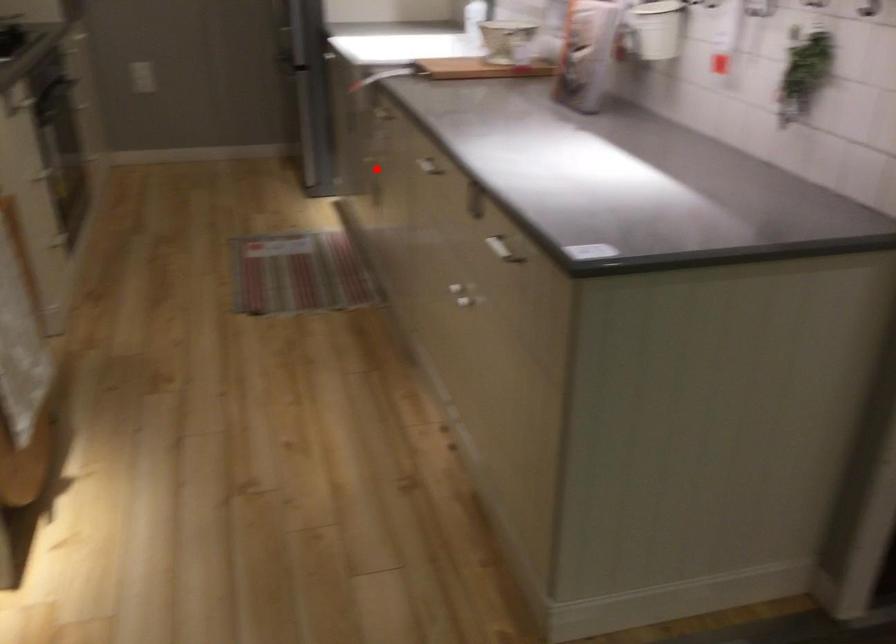
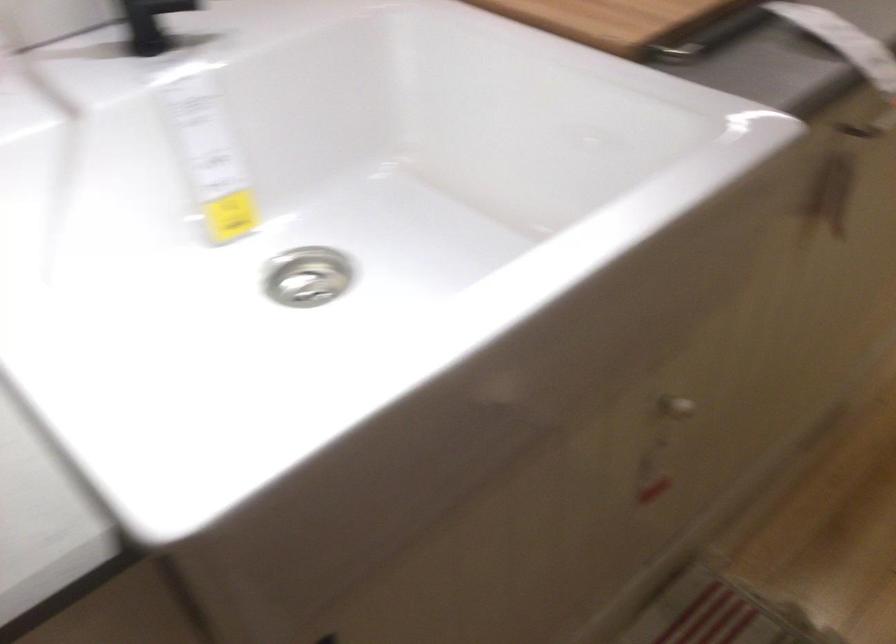
Where in the second image is the point corresponding to the highlighted location from the first image?

(675, 408)